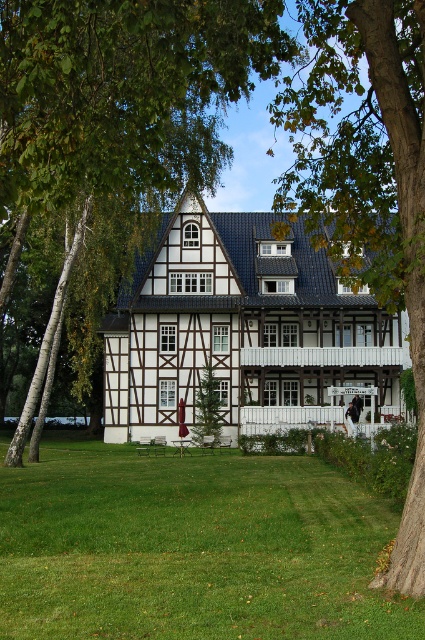
You are planning to install a new garden light in your backyard. You want to place it between the green leafy tree at center and the smooth bark tree at center. Which tree should you place the light closer to if you want it to be closer to the taller tree?

The smooth bark tree at center is taller than the green leafy tree at center. Therefore, to place the light closer to the taller tree, you should position it closer to the smooth bark tree at center.

You are a gardener planning to install a new sprinkler system. You need to decide where to place the sprinkler so it can cover both the green grass lawn at center and the smooth bark tree at center. Considering their widths, which area should the sprinkler be placed closer to?

The green grass lawn at center is wider than the smooth bark tree at center. Therefore, the sprinkler should be placed closer to the smooth bark tree at center to ensure adequate coverage for both areas.

You are standing in front of the house and notice two trees at the center. The green leafy tree at center and the smooth bark tree at center. Which one is positioned more to the left?

The green leafy tree at center is positioned to the left of the smooth bark tree at center, so it is more to the left.